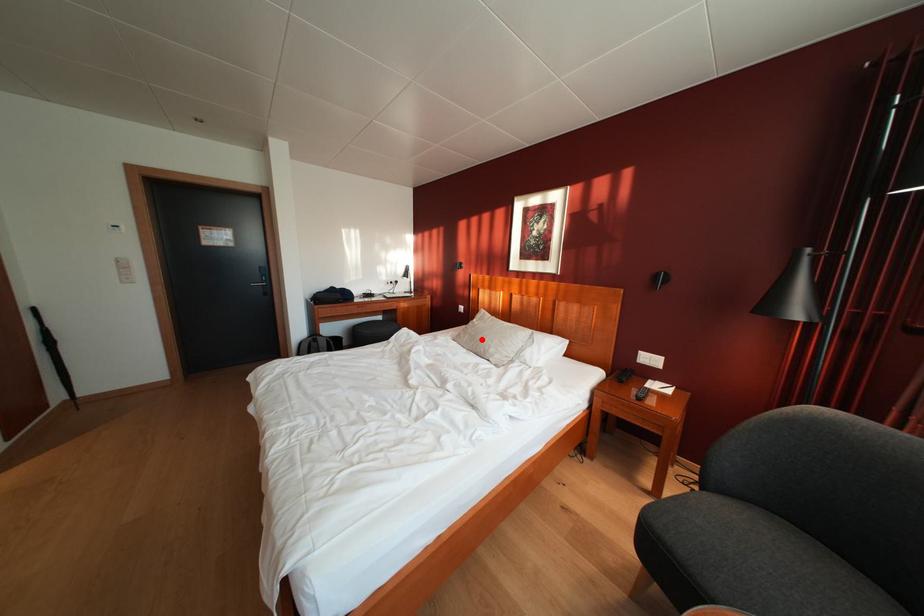
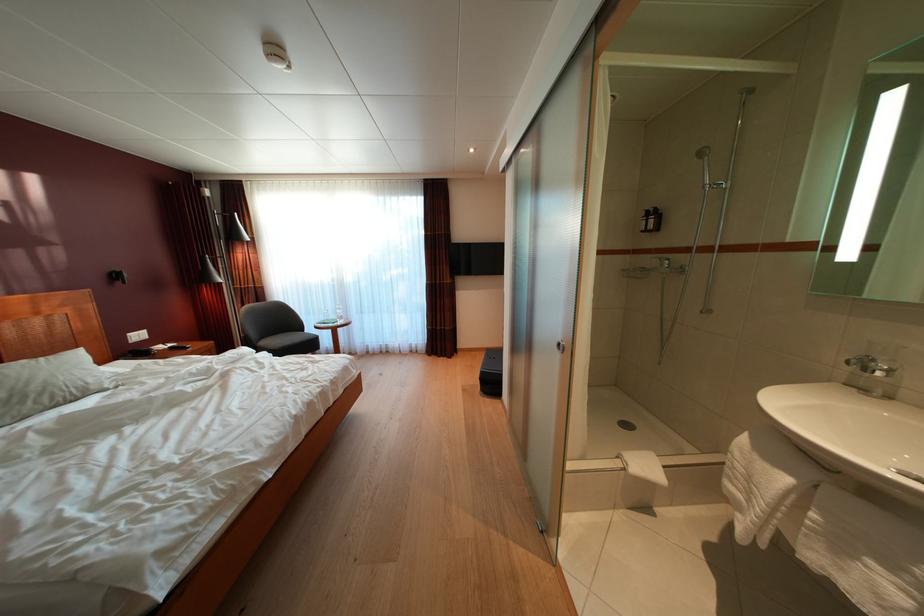
Question: I am providing you with two images of the same scene from different viewpoints. A red point is shown in image1. For the corresponding object point in image2, is it positioned nearer or farther from the camera?

Choices:
 (A) Nearer
 (B) Farther

Answer: (A)